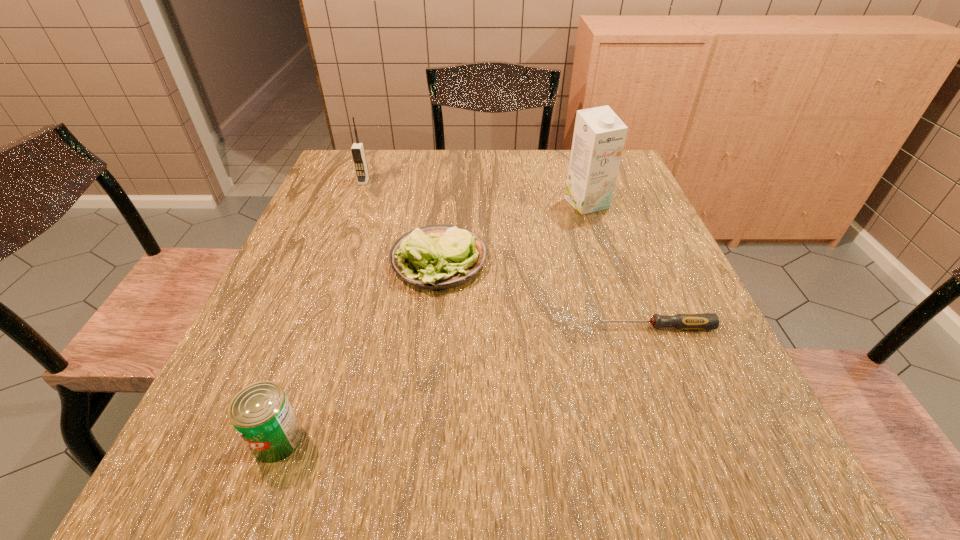
The image size is (960, 540). I want to click on empty space that is in between the shortest object and the lettuce, so click(x=547, y=294).

Locate an element on the screen. The image size is (960, 540). vacant area that lies between the third tallest object and the second nearest object is located at coordinates (467, 383).

Where is `object that is the third closest to the second shortest object`? This screenshot has width=960, height=540. object that is the third closest to the second shortest object is located at coordinates (357, 150).

Locate an element on the screen. The image size is (960, 540). object identified as the closest to the fourth nearest object is located at coordinates (435, 257).

This screenshot has width=960, height=540. What are the coordinates of `free space that satisfies the following two spatial constraints: 1. on the front-facing side of the third nearest object; 2. on the right side of the fourth shortest object` in the screenshot? It's located at (333, 261).

I want to click on vacant space that satisfies the following two spatial constraints: 1. on the front-facing side of the second tallest object; 2. on the right side of the fourth tallest object, so coord(333,261).

This screenshot has width=960, height=540. What are the coordinates of `free space in the image that satisfies the following two spatial constraints: 1. on the front-facing side of the third shortest object; 2. on the right side of the cellular telephone` in the screenshot? It's located at (265, 440).

At what (x,y) coordinates should I click in order to perform the action: click on free space that satisfies the following two spatial constraints: 1. on the front-facing side of the second shortest object; 2. on the left side of the cellular telephone. Please return your answer as a coordinate pair (x, y). The image size is (960, 540). Looking at the image, I should click on (333, 261).

Locate an element on the screen. vacant area in the image that satisfies the following two spatial constraints: 1. on the back side of the second farthest object; 2. on the left side of the can is located at coordinates (363, 204).